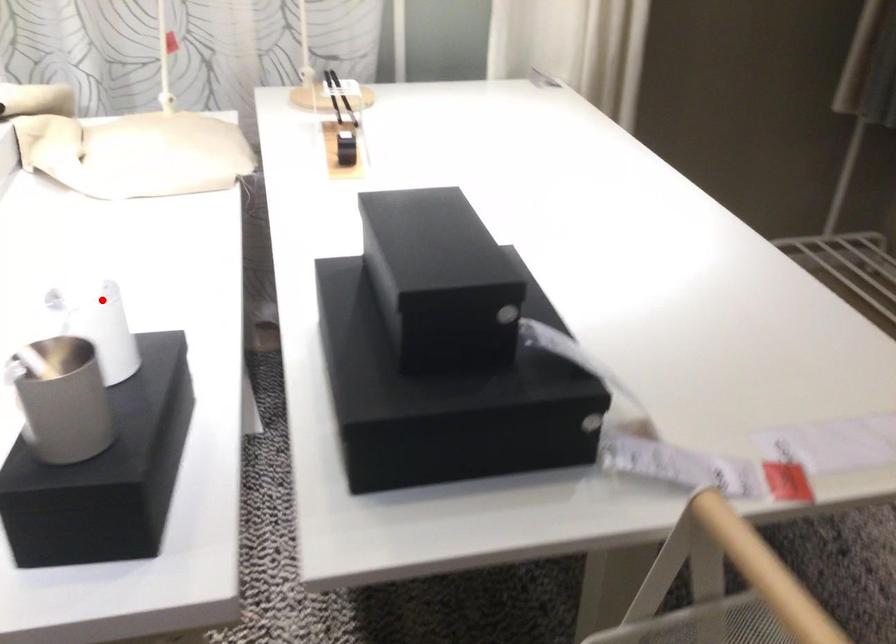
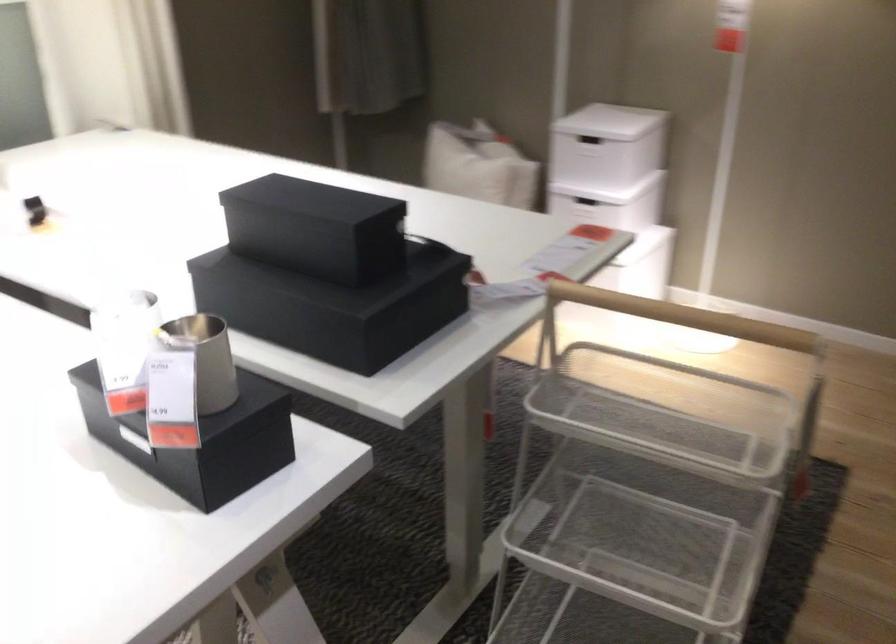
In the second image, find the point that corresponds to the highlighted location in the first image.

(122, 313)